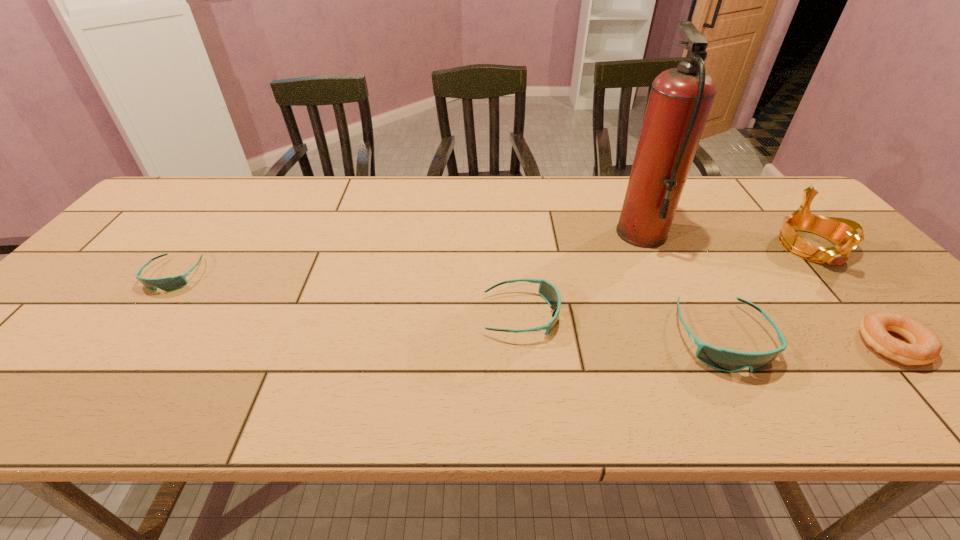
Where is `vacant space situated on the front-facing side of the fifth object from right to left`? The width and height of the screenshot is (960, 540). vacant space situated on the front-facing side of the fifth object from right to left is located at coordinates (585, 315).

Locate an element on the screen. free spot located at the front emblem of the fifth shortest object is located at coordinates (856, 297).

This screenshot has height=540, width=960. I want to click on free spot located at the nozzle of the fire extinguisher, so click(575, 234).

At what (x,y) coordinates should I click in order to perform the action: click on vacant space located 0.050m at the nozzle of the fire extinguisher. Please return your answer as a coordinate pair (x, y). The width and height of the screenshot is (960, 540). Looking at the image, I should click on (600, 234).

I want to click on vacant area located 0.080m at the nozzle of the fire extinguisher, so pos(589,234).

Where is `vacant space located 0.260m on the left of the bagel`? This screenshot has height=540, width=960. vacant space located 0.260m on the left of the bagel is located at coordinates (741, 345).

Locate an element on the screen. Image resolution: width=960 pixels, height=540 pixels. object that is at the far edge is located at coordinates (680, 100).

You are a GUI agent. You are given a task and a screenshot of the screen. Output one action in this format:
    pyautogui.click(x=<x>, y=<y>)
    Task: Click on the bagel situated at the near edge
    
    Given the screenshot: What is the action you would take?
    pyautogui.click(x=925, y=346)

At what (x,y) coordinates should I click in order to perform the action: click on tiara present at the right edge. Please return your answer as a coordinate pair (x, y). Looking at the image, I should click on (846, 234).

What are the coordinates of `bagel located at the right edge` in the screenshot? It's located at (925, 346).